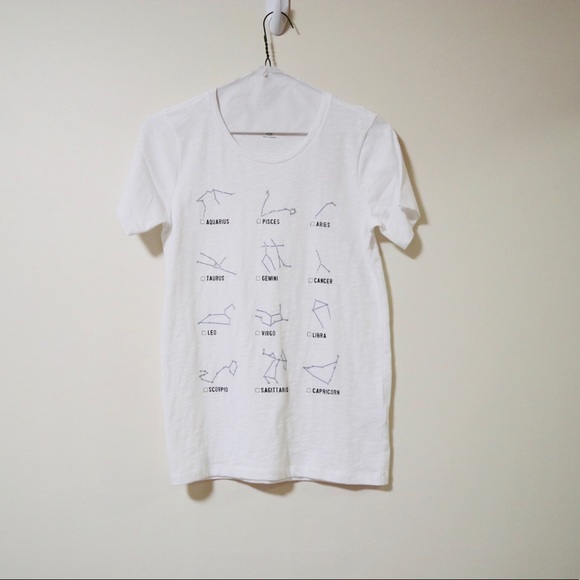
This screenshot has width=580, height=580. I want to click on white plastic on wall for hanging clothes, so click(x=278, y=16).